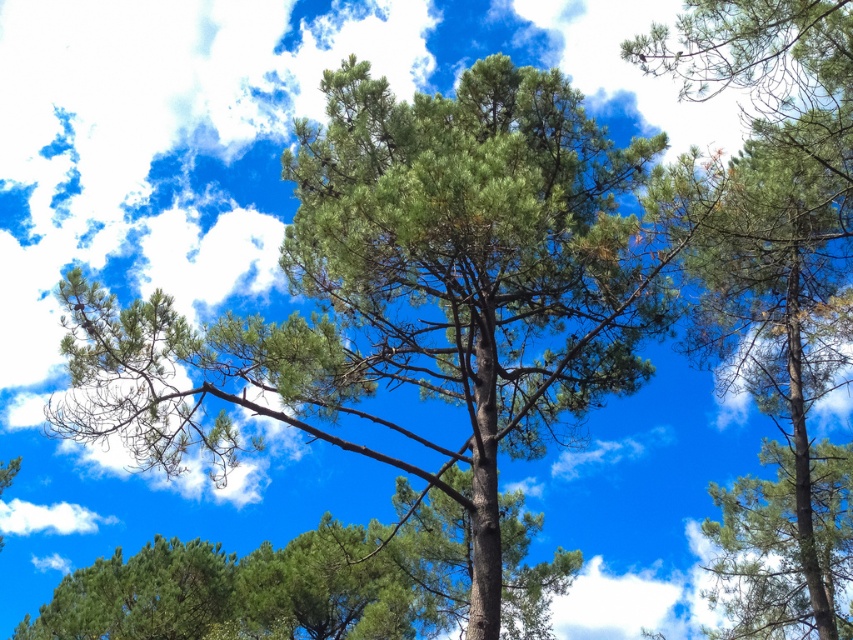
Can you confirm if green needle-like at center is positioned to the right of green needle-like at upper right?

In fact, green needle-like at center is to the left of green needle-like at upper right.

Is green needle-like at center above green needle-like at upper right?

Actually, green needle-like at center is below green needle-like at upper right.

Between point (535, 104) and point (850, 497), which one is positioned behind?

The point (850, 497) is more distant.

Identify the location of green needle-like at center. Image resolution: width=853 pixels, height=640 pixels. (387, 362).